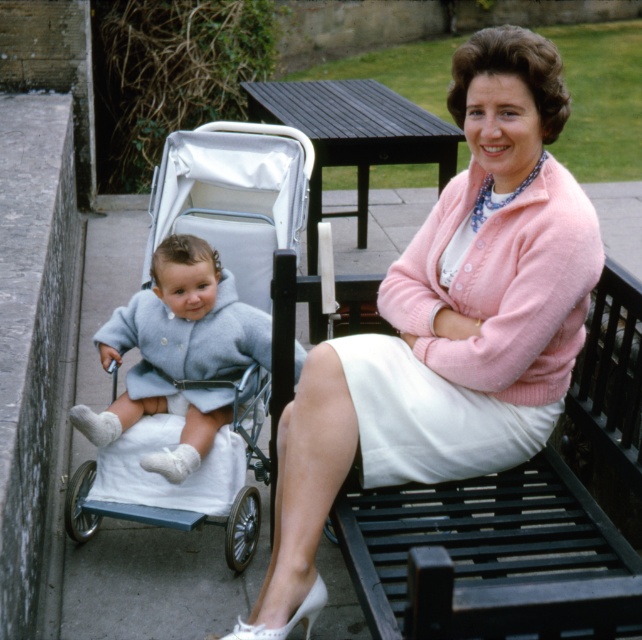
You are an observer looking at the scene. Can you tell me which item is positioned higher between the pink woolen cardigan at upper right and the white fabric skirt at center?

The pink woolen cardigan at upper right is located above the white fabric skirt at center, so it is positioned higher.

You are a fashion designer observing the image. You need to decide if a 4.5 inch wide accessory can fit between the pink woolen cardigan at upper right and the white fabric skirt at center without overlapping either. Can it fit?

The distance between the pink woolen cardigan at upper right and the white fabric skirt at center is 4.63 inches. Since the accessory is 4.5 inches wide, it can fit between them without overlapping.

You are standing at the entrance of the garden and want to sit down on the black wooden bench at upper center. Based on its coordinates, can you estimate how far it is from the entrance?

The black wooden bench at upper center is located at coordinates point [489,557], which means it is positioned towards the upper right side of the garden. To estimate the distance, if the garden is a standard rectangular space, the bench would be approximately 87.2 centimeters from the left edge and 76.2 centimeters from the bottom edge. However, without knowing the exact dimensions of the garden, it is difficult to provide an exact distance from the entrance.